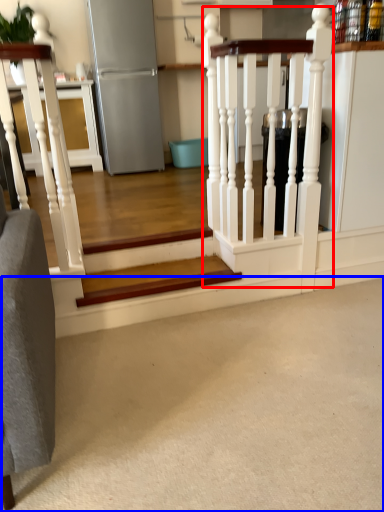
Question: Which point is closer to the camera, rail (highlighted by a red box) or concrete (highlighted by a blue box)?

Choices:
 (A) rail
 (B) concrete

Answer: (B)